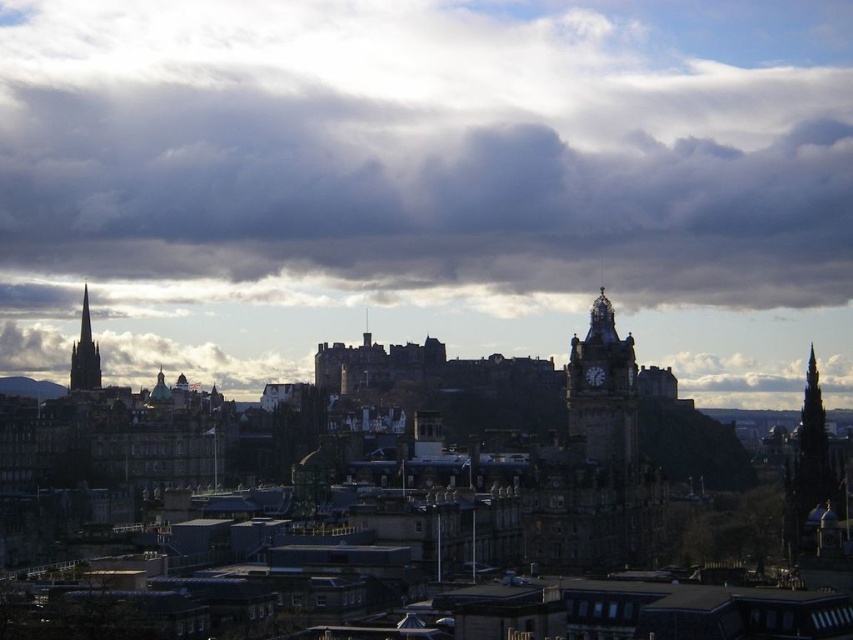
You are standing in Edinburgh and looking at the historic skyline. There are two points marked in the scene, one at coordinates point (579, 392) and another at point (97, 385). Which point is nearer to you?

Point (579, 392) is closer to the viewer than point (97, 385).

Consider the image. You are a tourist in Edinburgh and want to take a photo of the castle and the clock tower. You have two points marked on your map at coordinates point (236, 342) and point (625, 449). Which point should you choose to ensure both the Edinburgh Castle and the clock tower are visible in your photo without any obstructions?

You should choose point (625, 449) because point (236, 342) is behind it, meaning that standing at point (625, 449) would provide a clearer, unobstructed view of both the Edinburgh Castle and the clock tower.

You are standing at the entrance of Edinburgh Castle and want to locate the stone clock tower at center. According to the coordinates provided, in which direction should you look to find it?

The stone clock tower at center is located at coordinates point (602, 388). Since the castle is in the midground and the clock tower is in the center, you should look towards the central area of the view to find it.